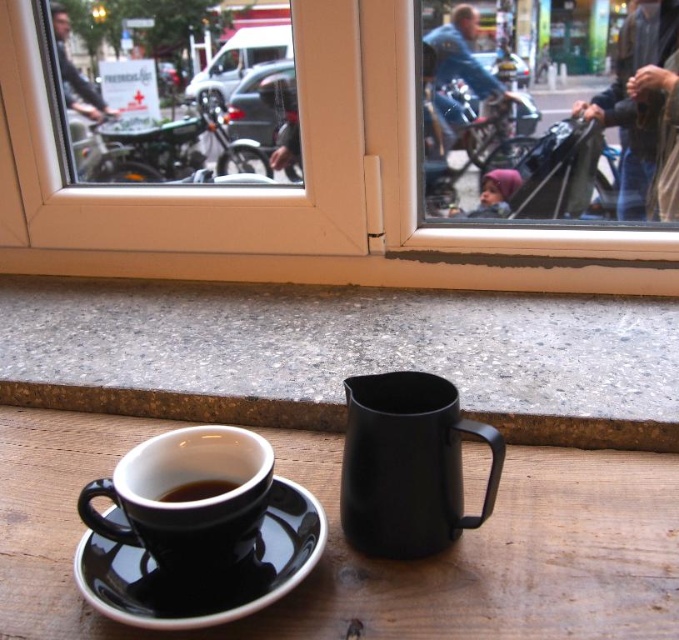
Question: Is the position of black matte mug at lower left less distant than that of black glossy cup at lower left?

Choices:
 (A) no
 (B) yes

Answer: (B)

Question: Which of these objects is positioned farthest from the black glossy cup at lower left?

Choices:
 (A) black matte mug at lower left
 (B) black matte wood table at center

Answer: (B)

Question: Can you confirm if black matte pitcher at center is positioned above black ceramic saucer at lower left?

Choices:
 (A) no
 (B) yes

Answer: (B)

Question: Which point is farther from the camera taking this photo?

Choices:
 (A) (456, 528)
 (B) (175, 566)
 (C) (168, 492)
 (D) (562, 344)

Answer: (D)

Question: Among these objects, which one is farthest from the camera?

Choices:
 (A) black matte wood table at center
 (B) transparent glass window at center

Answer: (B)

Question: Does granite gray window sill at lower center come behind black matte mug at lower left?

Choices:
 (A) yes
 (B) no

Answer: (A)